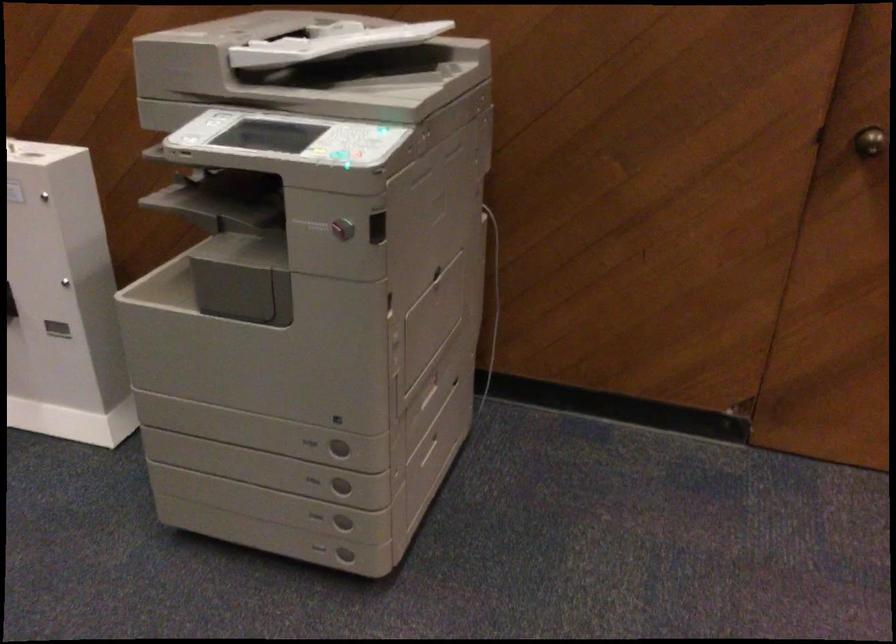
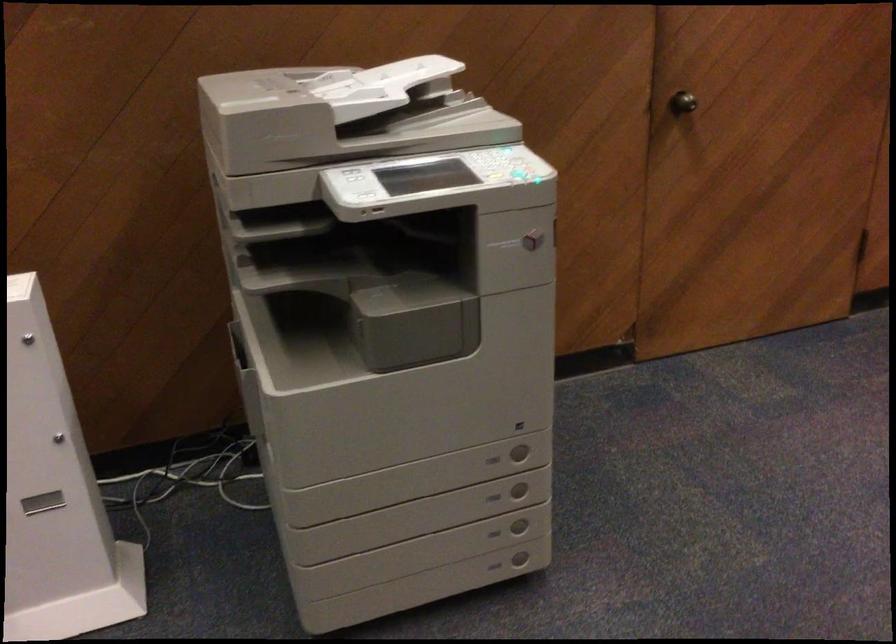
Find the pixel in the second image that matches [341,526] in the first image.

(519, 527)